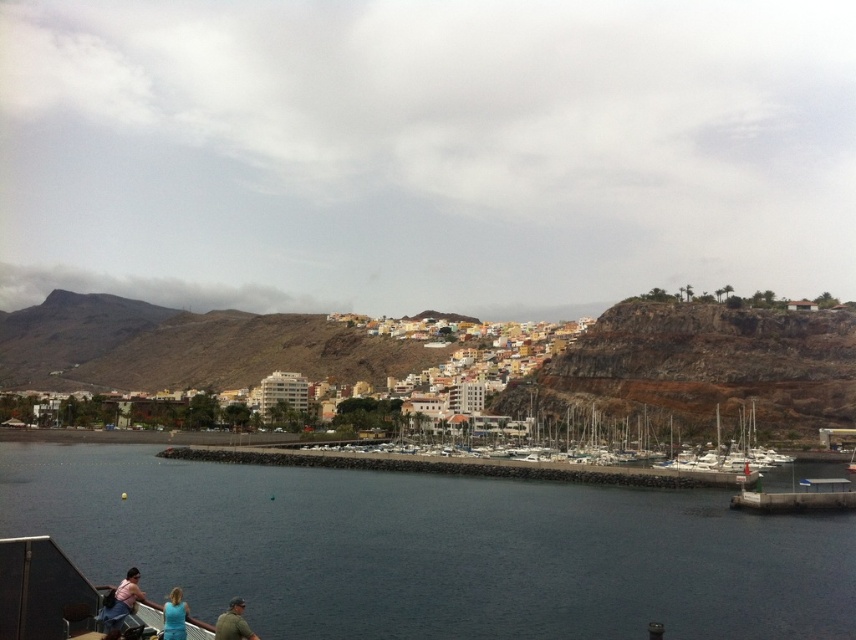
Is brown rocky hillside at upper center bigger than matte pink shirt at lower left?

Yes.

Does brown rocky hillside at upper center come behind matte pink shirt at lower left?

Yes, it is.

Which is behind, point (764, 310) or point (140, 593)?

Positioned behind is point (764, 310).

Where is `brown rocky hillside at upper center`? Image resolution: width=856 pixels, height=640 pixels. brown rocky hillside at upper center is located at coordinates (699, 369).

Between matte pink shirt at lower left and green fabric shirt at lower center, which one appears on the right side from the viewer's perspective?

Positioned to the right is green fabric shirt at lower center.

Locate an element on the screen. The height and width of the screenshot is (640, 856). matte pink shirt at lower left is located at coordinates (120, 602).

Does green fabric shirt at lower center have a larger size compared to blue fabric shirt at lower left?

Yes, green fabric shirt at lower center is bigger than blue fabric shirt at lower left.

Does green fabric shirt at lower center appear on the left side of blue fabric shirt at lower left?

No, green fabric shirt at lower center is not to the left of blue fabric shirt at lower left.

Is point (235, 627) farther from viewer compared to point (181, 602)?

No, it is in front of (181, 602).

Find the location of a particular element. The image size is (856, 640). green fabric shirt at lower center is located at coordinates (233, 621).